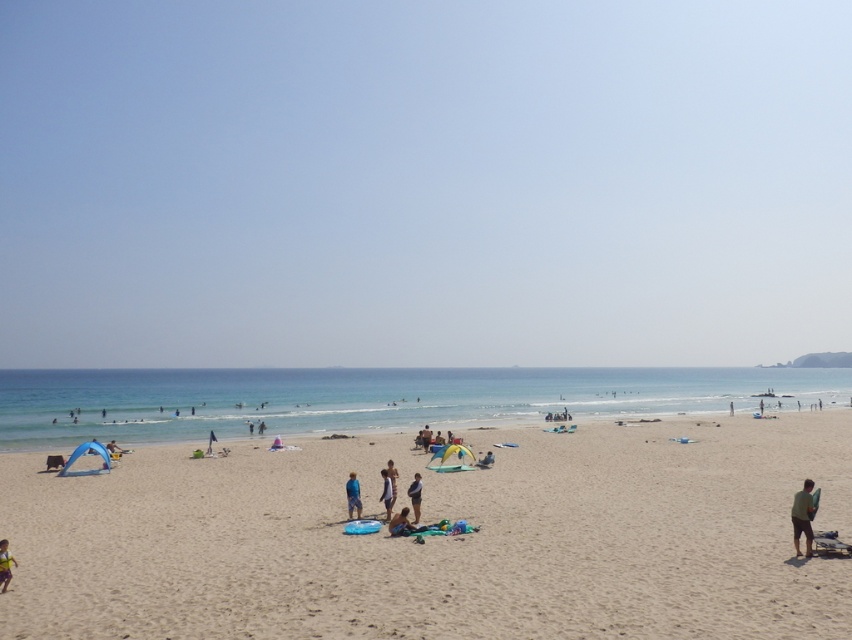
You are standing on the beach and want to look up at the transparent blue sky at upper center. Which direction should you look to find it?

The transparent blue sky at upper center is located at point (423, 182), so you should look upwards towards the center of the sky to find it.